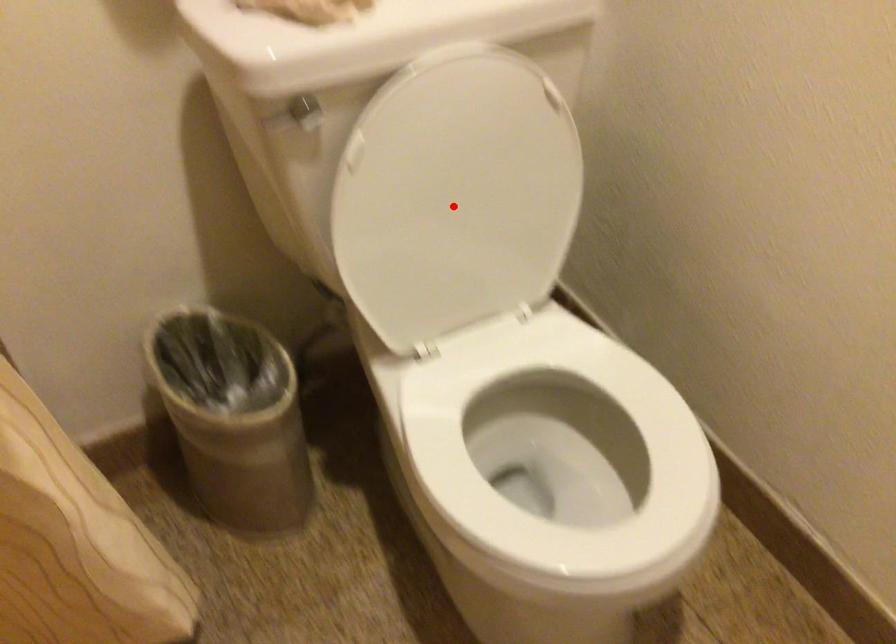
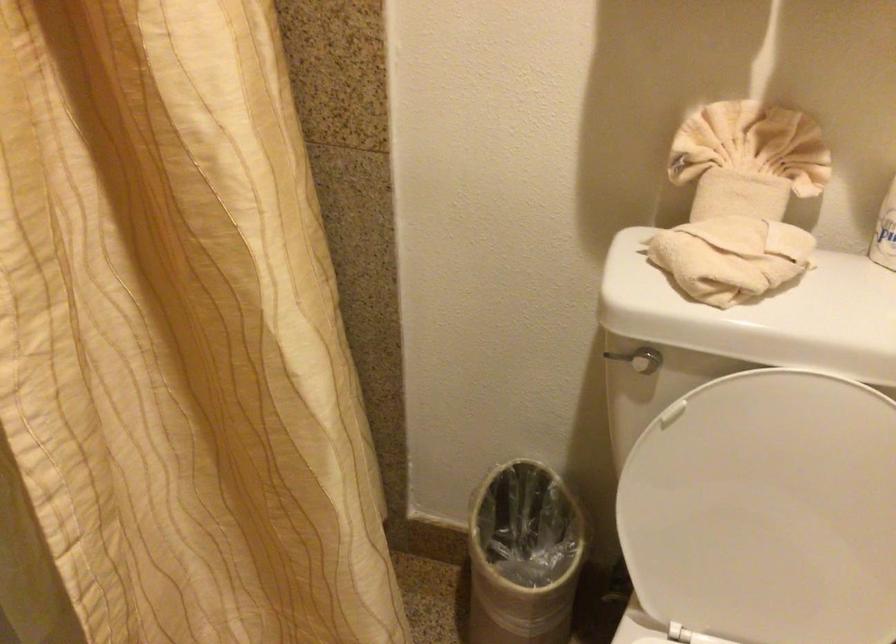
The point at the highlighted location is marked in the first image. Where is the corresponding point in the second image?

(767, 511)